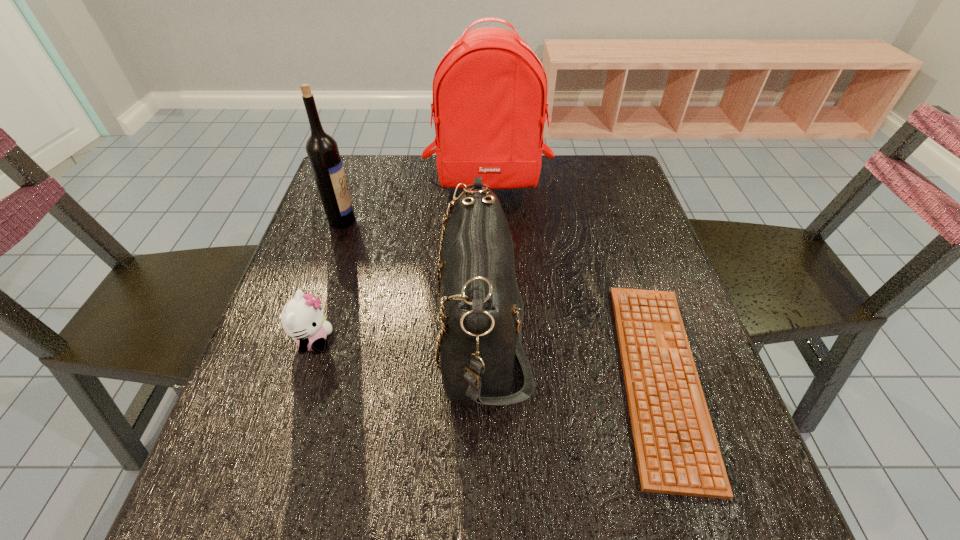
Where is `object at the near right corner`? object at the near right corner is located at coordinates (677, 451).

The width and height of the screenshot is (960, 540). In order to click on vacant area at the left edge in this screenshot , I will do `click(284, 292)`.

Locate an element on the screen. The width and height of the screenshot is (960, 540). free spot at the right edge of the desktop is located at coordinates (599, 246).

Locate an element on the screen. free region at the far left corner of the desktop is located at coordinates (377, 164).

Find the location of a particular element. vacant area at the near left corner of the desktop is located at coordinates (207, 516).

The image size is (960, 540). I want to click on vacant space at the far right corner of the desktop, so click(x=594, y=164).

The width and height of the screenshot is (960, 540). I want to click on free space at the near right corner, so click(x=667, y=505).

Image resolution: width=960 pixels, height=540 pixels. In order to click on empty space that is in between the backpack and the fourth shortest object in this screenshot , I will do `click(415, 202)`.

The image size is (960, 540). Identify the location of blank region between the second farthest object and the second shortest object. (328, 280).

Locate an element on the screen. free space that is in between the wine bottle and the fourth tallest object is located at coordinates (328, 280).